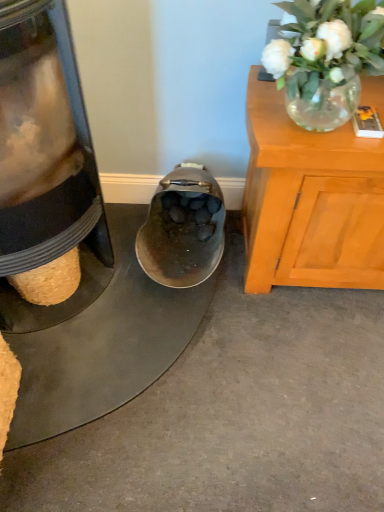
Identify the location of spots to the right of shiny metallic shoe at center. (277, 295).